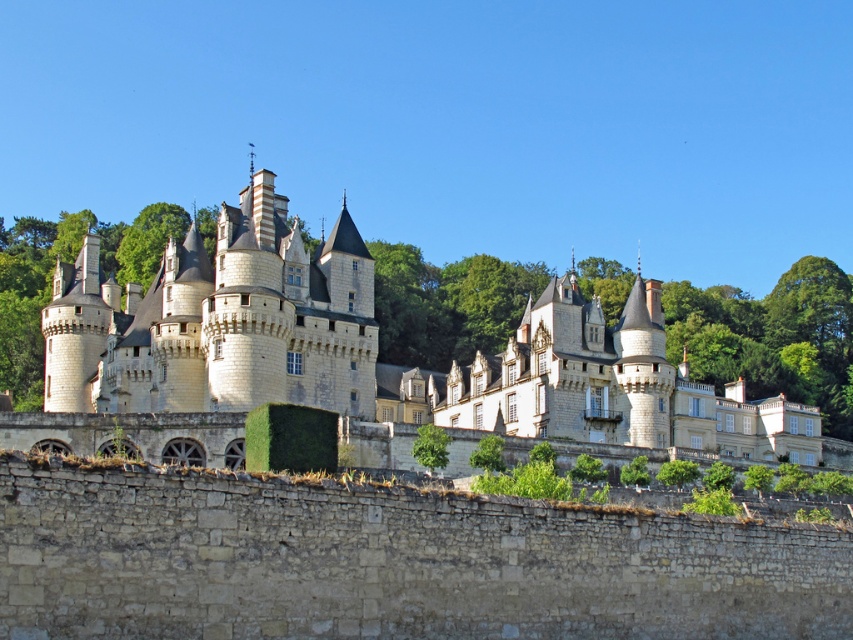
You are standing at a point 100 meters away from the castle. You want to walk towards the castle and reach the point marked as point (x=125, y=333). Is the distance you need to cover more or less than 100 meters?

The distance between point (x=125, y=333) and the viewer is 100.16 meters, so you need to cover more than 100 meters to reach it.

Based on the scene description, where is the white stone castle at center located in terms of its 2D coordinates?

The white stone castle at center is located at the 2D coordinates of point (451, 337).

You are a medieval architect planning to build a new structure. You observe the white stone castle at center and the gray stone wall at lower center in the image. Which structure has a greater width?

The white stone castle at center has a greater width than the gray stone wall at lower center.